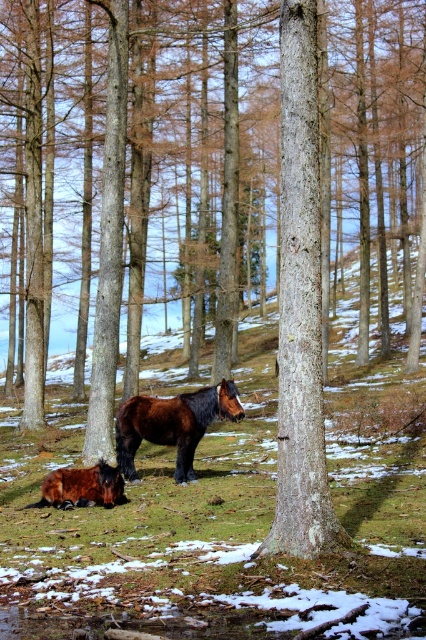
Does point (305, 374) come behind point (109, 493)?

No, (305, 374) is in front of (109, 493).

Between smooth bark tree trunk at center and shiny brown horse at lower left, which one is positioned lower?

shiny brown horse at lower left is lower down.

Locate an element on the screen. The height and width of the screenshot is (640, 426). smooth bark tree trunk at center is located at coordinates (299, 305).

In the scene shown: Is smooth bark tree trunk at center above shiny brown horse at center?

Correct, smooth bark tree trunk at center is located above shiny brown horse at center.

Which is in front, point (316, 22) or point (186, 465)?

Point (316, 22)

Based on the photo, who is more distant from viewer, [305,170] or [196,420]?

Positioned behind is point [196,420].

Find the location of a particular element. The image size is (426, 640). smooth bark tree trunk at center is located at coordinates [299, 305].

Which is below, shiny brown horse at center or shiny brown horse at lower left?

Positioned lower is shiny brown horse at lower left.

Which is more to the right, shiny brown horse at center or shiny brown horse at lower left?

shiny brown horse at center is more to the right.

Between point (124, 442) and point (36, 506), which one is positioned in front?

Point (36, 506)

This screenshot has width=426, height=640. Find the location of `shiny brown horse at center`. shiny brown horse at center is located at coordinates (172, 424).